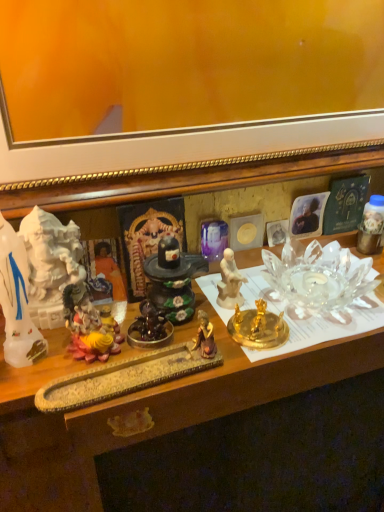
Question: From a real-world perspective, is shiny dark brown statue at center, arranged as the 4th toy when viewed from the right, under metallic gold figurine at right, positioned as the 6th toy in left-to-right order?

Choices:
 (A) no
 (B) yes

Answer: (B)

Question: Is shiny dark brown statue at center, arranged as the 4th toy when viewed from the right, shorter than metallic gold figurine at right, acting as the first toy starting from the right?

Choices:
 (A) no
 (B) yes

Answer: (B)

Question: Is shiny dark brown statue at center, arranged as the 4th toy when viewed from the right, aimed at metallic gold figurine at right, acting as the first toy starting from the right?

Choices:
 (A) no
 (B) yes

Answer: (A)

Question: Does shiny dark brown statue at center, the 3th toy viewed from the left, touch metallic gold figurine at right, acting as the first toy starting from the right?

Choices:
 (A) yes
 (B) no

Answer: (B)

Question: Can you confirm if shiny dark brown statue at center, arranged as the 4th toy when viewed from the right, is positioned to the right of metallic gold figurine at right, acting as the first toy starting from the right?

Choices:
 (A) yes
 (B) no

Answer: (B)

Question: From a real-world perspective, relative to purple glass vase at center, marked as the second toy in a right-to-left arrangement, is orange fabric at center, the first person from the left, vertically above or below?

Choices:
 (A) below
 (B) above

Answer: (B)

Question: Is orange fabric at center, the first person from the left, to the left or to the right of purple glass vase at center, positioned as the 5th toy in left-to-right order, in the image?

Choices:
 (A) right
 (B) left

Answer: (B)

Question: Is orange fabric at center, the first person from the left, taller or shorter than purple glass vase at center, positioned as the 5th toy in left-to-right order?

Choices:
 (A) tall
 (B) short

Answer: (B)

Question: Considering the positions of orange fabric at center, which is the 2th person in right-to-left order, and purple glass vase at center, marked as the second toy in a right-to-left arrangement, in the image, is orange fabric at center, which is the 2th person in right-to-left order, wider or thinner than purple glass vase at center, marked as the second toy in a right-to-left arrangement,?

Choices:
 (A) wide
 (B) thin

Answer: (A)

Question: From their relative heights in the image, would you say orange fabric at center, the first person from the left, is taller or shorter than metallic gold figurine at right, acting as the first toy starting from the right?

Choices:
 (A) tall
 (B) short

Answer: (A)

Question: From the image's perspective, is orange fabric at center, the first person from the left, above or below metallic gold figurine at right, positioned as the 6th toy in left-to-right order?

Choices:
 (A) above
 (B) below

Answer: (B)

Question: Do you think orange fabric at center, the first person from the left, is within metallic gold figurine at right, positioned as the 6th toy in left-to-right order, or outside of it?

Choices:
 (A) outside
 (B) inside

Answer: (A)

Question: Is orange fabric at center, the first person from the left, to the left or to the right of metallic gold figurine at right, positioned as the 6th toy in left-to-right order, in the image?

Choices:
 (A) left
 (B) right

Answer: (A)

Question: In terms of width, does shiny dark brown statue at center, arranged as the 4th toy when viewed from the right, look wider or thinner when compared to matte yellow statue at center, placed as the 5th toy when sorted from right to left?

Choices:
 (A) thin
 (B) wide

Answer: (A)

Question: From their relative heights in the image, would you say shiny dark brown statue at center, arranged as the 4th toy when viewed from the right, is taller or shorter than matte yellow statue at center, placed as the 2th toy when sorted from left to right?

Choices:
 (A) tall
 (B) short

Answer: (B)